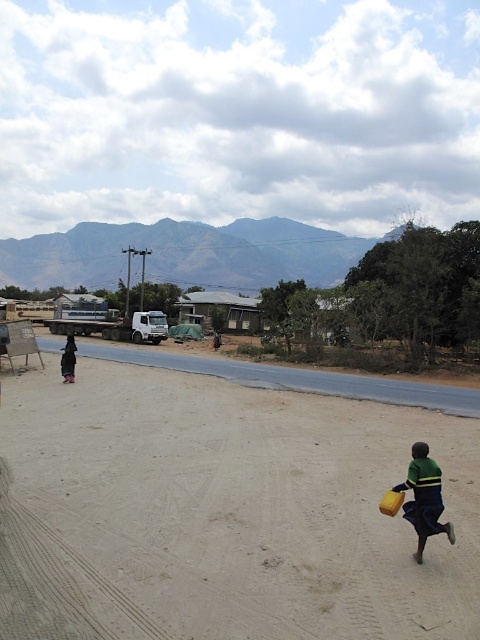
Which is behind, point (391, 419) or point (72, 356)?

Positioned behind is point (72, 356).

Is point (145, 422) closer to camera compared to point (61, 376)?

Yes.

Between point (300, 525) and point (72, 349), which one is positioned behind?

Point (72, 349)

Locate an element on the screen. Image resolution: width=480 pixels, height=640 pixels. brown sandy dirt track at lower center is located at coordinates (222, 513).

Is point (184, 605) farther from camera compared to point (436, 465)?

No.

In order to click on brown sandy dirt track at lower center in this screenshot , I will do `click(222, 513)`.

I want to click on brown sandy dirt track at lower center, so click(x=222, y=513).

Does green jersey at lower right have a greater width compared to black fabric child at left?

In fact, green jersey at lower right might be narrower than black fabric child at left.

How distant is green jersey at lower right from black fabric child at left?

green jersey at lower right is 14.95 meters from black fabric child at left.

Between point (432, 477) and point (70, 346), which one is positioned in front?

Point (432, 477) is in front.

Locate an element on the screen. green jersey at lower right is located at coordinates (423, 497).